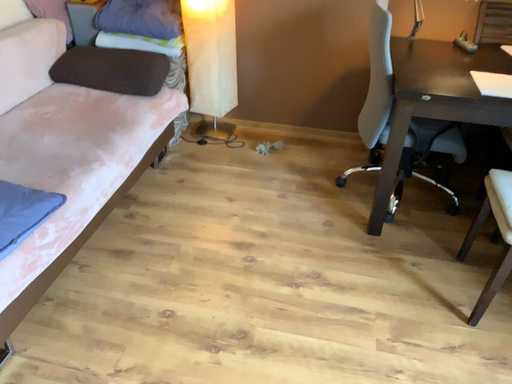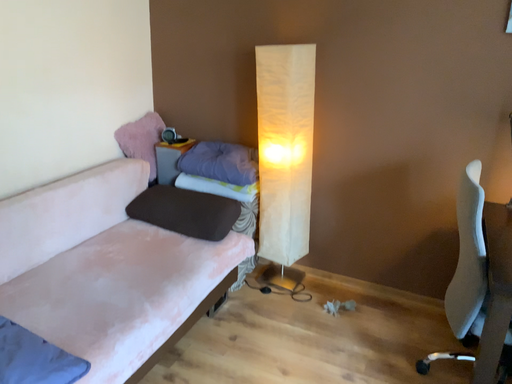
Question: How did the camera likely rotate when shooting the video?

Choices:
 (A) rotated upward
 (B) rotated downward

Answer: (A)